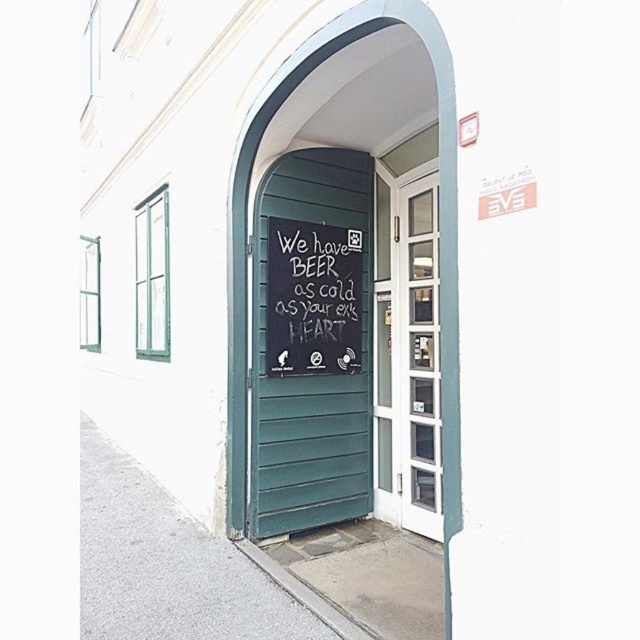
Is green wooden door at center shorter than chalkboard at center?

No.

Does point (298, 269) come farther from viewer compared to point (323, 289)?

No, (298, 269) is closer to viewer.

Where is `green wooden door at center`? The image size is (640, 640). green wooden door at center is located at coordinates (310, 342).

Does point (268, 202) come in front of point (433, 321)?

No, it is behind (433, 321).

Locate an element on the screen. green wooden door at center is located at coordinates (310, 342).

Identify the location of white glass door at center. (419, 356).

What do you see at coordinates (419, 356) in the screenshot? The height and width of the screenshot is (640, 640). I see `white glass door at center` at bounding box center [419, 356].

The width and height of the screenshot is (640, 640). What are the coordinates of `white glass door at center` in the screenshot? It's located at (419, 356).